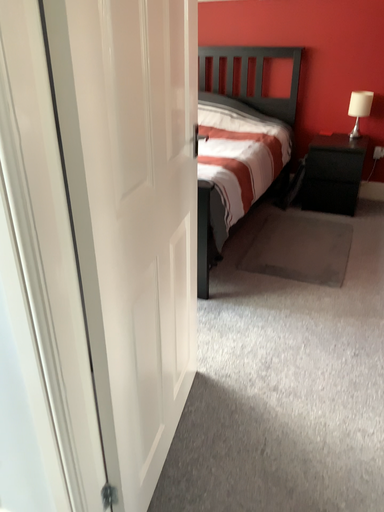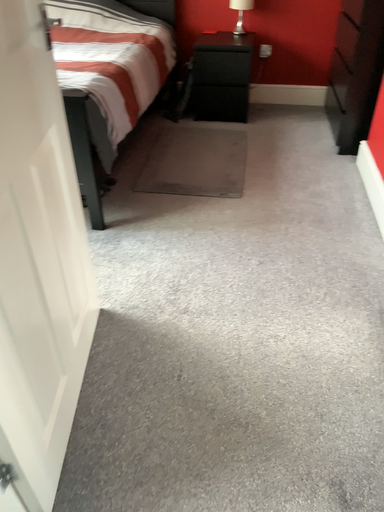
Question: Which way did the camera rotate in the video?

Choices:
 (A) rotated left
 (B) rotated right

Answer: (B)